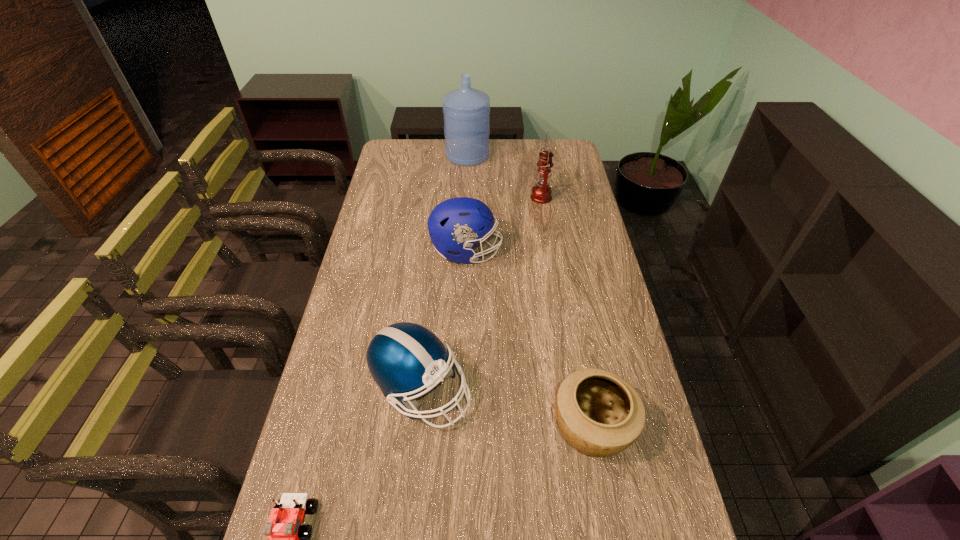
Locate an element on the screen. The height and width of the screenshot is (540, 960). free location that satisfies the following two spatial constraints: 1. at the front of the second shortest object with the faceguard; 2. on the left side of the nearer football helmet is located at coordinates [x=418, y=428].

The height and width of the screenshot is (540, 960). In order to click on free spot that satisfies the following two spatial constraints: 1. on the front side of the pottery; 2. on the right side of the oil lamp in this screenshot , I will do `click(578, 428)`.

At what (x,y) coordinates should I click in order to perform the action: click on free space that satisfies the following two spatial constraints: 1. at the front of the nearer football helmet with the faceguard; 2. on the right side of the pottery. Please return your answer as a coordinate pair (x, y). This screenshot has height=540, width=960. Looking at the image, I should click on (418, 428).